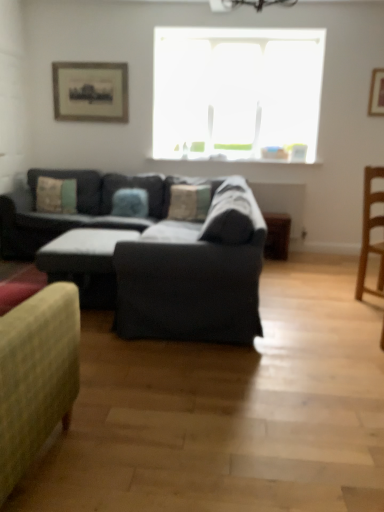
Question: Should I look upward or downward to see transparent glass window at upper center?

Choices:
 (A) up
 (B) down

Answer: (A)

Question: From the image's perspective, is dark gray fabric couch at center on transparent glass window at upper center?

Choices:
 (A) no
 (B) yes

Answer: (A)

Question: Is dark gray fabric couch at center outside of transparent glass window at upper center?

Choices:
 (A) no
 (B) yes

Answer: (B)

Question: Does dark gray fabric couch at center turn towards transparent glass window at upper center?

Choices:
 (A) yes
 (B) no

Answer: (B)

Question: Can you confirm if dark gray fabric couch at center is smaller than transparent glass window at upper center?

Choices:
 (A) no
 (B) yes

Answer: (A)

Question: Considering the relative sizes of dark gray fabric couch at center and transparent glass window at upper center in the image provided, is dark gray fabric couch at center taller than transparent glass window at upper center?

Choices:
 (A) no
 (B) yes

Answer: (A)

Question: Is dark gray fabric couch at center next to transparent glass window at upper center and touching it?

Choices:
 (A) no
 (B) yes

Answer: (A)

Question: Is wooden framed print at upper left, which appears as the 1th picture frame when viewed from the left, positioned beyond the bounds of wooden side table at lower right?

Choices:
 (A) yes
 (B) no

Answer: (A)

Question: Is wooden framed print at upper left, positioned as the 1th picture frame in back-to-front order, turned away from wooden side table at lower right?

Choices:
 (A) no
 (B) yes

Answer: (A)

Question: Does wooden framed print at upper left, which appears as the 1th picture frame when viewed from the left, have a smaller size compared to wooden side table at lower right?

Choices:
 (A) yes
 (B) no

Answer: (A)

Question: Is wooden framed print at upper left, placed as the 2th picture frame when sorted from right to left, taller than wooden side table at lower right?

Choices:
 (A) yes
 (B) no

Answer: (A)

Question: Is wooden framed print at upper left, placed as the 2th picture frame when sorted from right to left, aimed at wooden side table at lower right?

Choices:
 (A) yes
 (B) no

Answer: (B)

Question: Is wooden framed print at upper left, which appears as the 1th picture frame when viewed from the left, wider than wooden side table at lower right?

Choices:
 (A) yes
 (B) no

Answer: (B)

Question: From a real-world perspective, does light brown wooden chair at right stand above dark gray fabric couch at center?

Choices:
 (A) no
 (B) yes

Answer: (B)